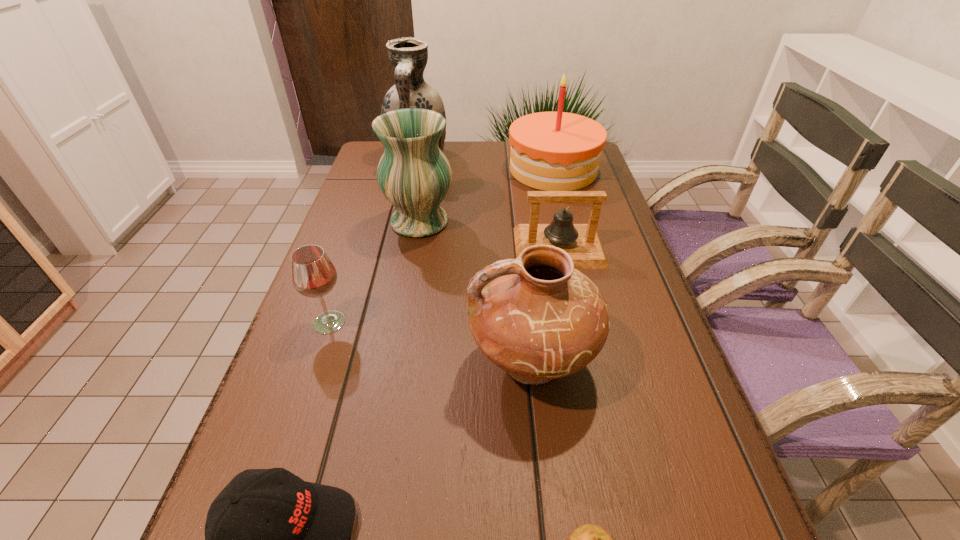
This screenshot has height=540, width=960. Find the location of `bell that is at the right edge`. bell that is at the right edge is located at coordinates (582, 242).

In order to click on object that is at the far left corner in this screenshot , I will do `click(408, 56)`.

What are the coordinates of `object that is at the far right corner` in the screenshot? It's located at (551, 151).

Where is `free space at the left edge of the desktop`? free space at the left edge of the desktop is located at coordinates (346, 211).

At what (x,y) coordinates should I click in order to perform the action: click on free space at the right edge. Please return your answer as a coordinate pair (x, y). The height and width of the screenshot is (540, 960). Looking at the image, I should click on (639, 278).

Where is `free space between the sixth tallest object and the nearer vase`? The height and width of the screenshot is (540, 960). free space between the sixth tallest object and the nearer vase is located at coordinates (490, 234).

What are the coordinates of `vacant space that's between the sixth tallest object and the nearer vase` in the screenshot? It's located at (490, 234).

Where is `vacant space that's between the nearer vase and the birthday cake`? This screenshot has width=960, height=540. vacant space that's between the nearer vase and the birthday cake is located at coordinates (487, 195).

Locate an element on the screen. The image size is (960, 540). object that can be found as the fifth closest to the birthday cake is located at coordinates (313, 275).

Identify the location of object that is the seventh nearest to the shorter vase. (589, 539).